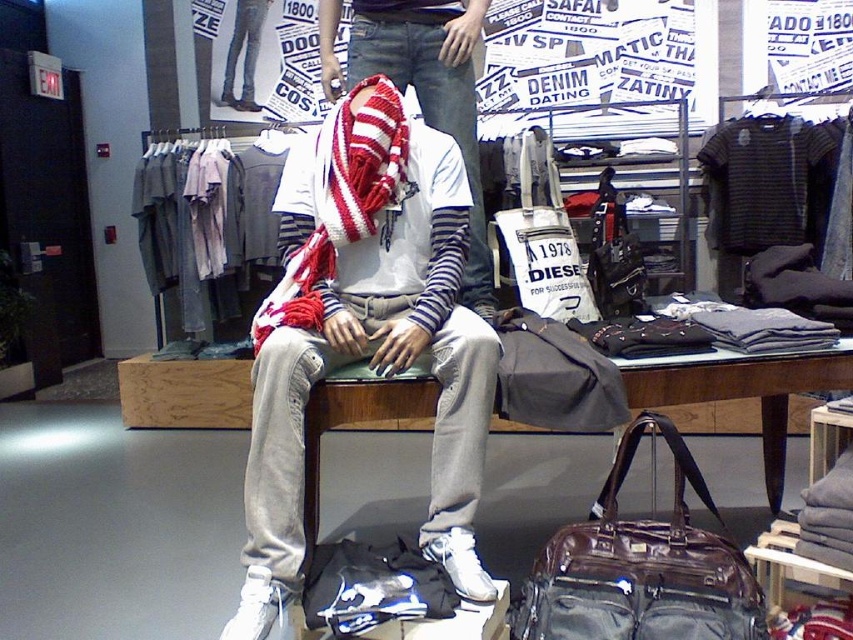
Consider the image. You are a store employee who needs to organize the items on the floor. The store requires that all items must be at least 15 inches apart for easy access. Are the knit scarf at center and the matte gray duffel bag at center currently meeting this requirement?

The knit scarf at center is 12.76 inches from the matte gray duffel bag at center. Since 12.76 inches is less than the required 15 inches, they are not meeting the store requirement.

You are a customer in the store and want to pick up the striped cotton scarf at center. Is the leather suitcase at lower center blocking your path to it?

The leather suitcase at lower center is in front of the striped cotton scarf at center, so it is blocking the path to the scarf.

You are a customer in the store and want to pick up the knit scarf at center and the white canvas tote at center. Which item should you pick up first if you want to grab the taller item first?

The knit scarf at center is taller than the white canvas tote at center, so you should pick up the knit scarf at center first.